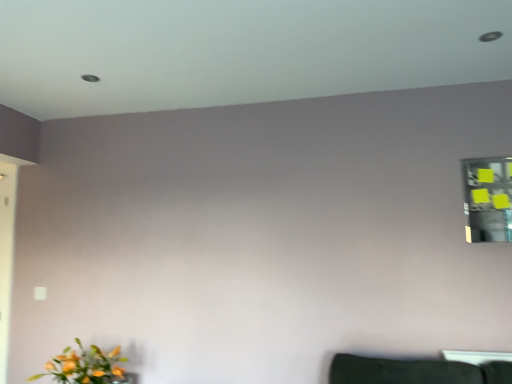
Measure the distance between matte orange flowers at lower left and camera.

matte orange flowers at lower left is 2.22 meters away from camera.

Describe the element at coordinates (84, 366) in the screenshot. This screenshot has height=384, width=512. I see `matte orange flowers at lower left` at that location.

The image size is (512, 384). What are the coordinates of `matte orange flowers at lower left` in the screenshot? It's located at (84, 366).

Find the location of `yellow sticky notes at upper right`. yellow sticky notes at upper right is located at coordinates (488, 199).

Measure the distance between point (508,191) and camera.

Point (508,191) is 7.66 feet from camera.

Image resolution: width=512 pixels, height=384 pixels. Describe the element at coordinates (488, 199) in the screenshot. I see `yellow sticky notes at upper right` at that location.

At what (x,y) coordinates should I click in order to perform the action: click on matte orange flowers at lower left. Please return your answer as a coordinate pair (x, y). This screenshot has height=384, width=512. Looking at the image, I should click on (84, 366).

Which is more to the right, matte orange flowers at lower left or yellow sticky notes at upper right?

yellow sticky notes at upper right is more to the right.

Is matte orange flowers at lower left in front of or behind yellow sticky notes at upper right in the image?

Clearly, matte orange flowers at lower left is in front of yellow sticky notes at upper right.

Considering the points (86, 361) and (484, 160), which point is in front, point (86, 361) or point (484, 160)?

The point (86, 361) is closer.

Looking at this image, from the image's perspective, would you say matte orange flowers at lower left is positioned over yellow sticky notes at upper right?

No, from the image's perspective, matte orange flowers at lower left is not over yellow sticky notes at upper right.

From a real-world perspective, is matte orange flowers at lower left on top of yellow sticky notes at upper right?

No.

Does matte orange flowers at lower left have a greater width compared to yellow sticky notes at upper right?

Yes.

Does matte orange flowers at lower left have a lesser height compared to yellow sticky notes at upper right?

Correct, matte orange flowers at lower left is not as tall as yellow sticky notes at upper right.

Who is smaller, matte orange flowers at lower left or yellow sticky notes at upper right?

yellow sticky notes at upper right.

Which is correct: matte orange flowers at lower left is inside yellow sticky notes at upper right, or outside of it?

matte orange flowers at lower left is spatially situated outside yellow sticky notes at upper right.

Is matte orange flowers at lower left positioned far away from yellow sticky notes at upper right?

matte orange flowers at lower left is far away from yellow sticky notes at upper right.

Is matte orange flowers at lower left oriented towards yellow sticky notes at upper right?

No, matte orange flowers at lower left is not facing towards yellow sticky notes at upper right.

At what (x,y) coordinates should I click in order to perform the action: click on flower lying on the left of yellow sticky notes at upper right. Please return your answer as a coordinate pair (x, y). Image resolution: width=512 pixels, height=384 pixels. Looking at the image, I should click on (84, 366).

Which is more to the left, yellow sticky notes at upper right or matte orange flowers at lower left?

matte orange flowers at lower left is more to the left.

Does yellow sticky notes at upper right come behind matte orange flowers at lower left?

That is True.

Does point (503, 193) appear closer or farther from the camera than point (123, 360)?

Point (503, 193).

From the image's perspective, would you say yellow sticky notes at upper right is positioned over matte orange flowers at lower left?

Indeed, from the image's perspective, yellow sticky notes at upper right is shown above matte orange flowers at lower left.

From a real-world perspective, is yellow sticky notes at upper right located beneath matte orange flowers at lower left?

No, from a real-world perspective, yellow sticky notes at upper right is not beneath matte orange flowers at lower left.

Is yellow sticky notes at upper right wider than matte orange flowers at lower left?

No.

In terms of height, does yellow sticky notes at upper right look taller or shorter compared to matte orange flowers at lower left?

In the image, yellow sticky notes at upper right appears to be taller than matte orange flowers at lower left.

Looking at the image, does yellow sticky notes at upper right seem bigger or smaller compared to matte orange flowers at lower left?

In the image, yellow sticky notes at upper right appears to be smaller than matte orange flowers at lower left.

Is matte orange flowers at lower left surrounded by yellow sticky notes at upper right?

Actually, matte orange flowers at lower left is outside yellow sticky notes at upper right.

In the scene shown: Is yellow sticky notes at upper right next to matte orange flowers at lower left and touching it?

No, yellow sticky notes at upper right is not in contact with matte orange flowers at lower left.

Could you tell me if yellow sticky notes at upper right is facing matte orange flowers at lower left?

No, yellow sticky notes at upper right is not oriented towards matte orange flowers at lower left.

Looking at this image, what's the angular difference between yellow sticky notes at upper right and matte orange flowers at lower left's facing directions?

The angle between the facing direction of yellow sticky notes at upper right and the facing direction of matte orange flowers at lower left is 1.95 degrees.

The image size is (512, 384). I want to click on flower to the left of yellow sticky notes at upper right, so (x=84, y=366).

The height and width of the screenshot is (384, 512). I want to click on mirror that is above the matte orange flowers at lower left (from the image's perspective), so click(x=488, y=199).

What are the coordinates of `mirror on the right of matte orange flowers at lower left` in the screenshot? It's located at (488, 199).